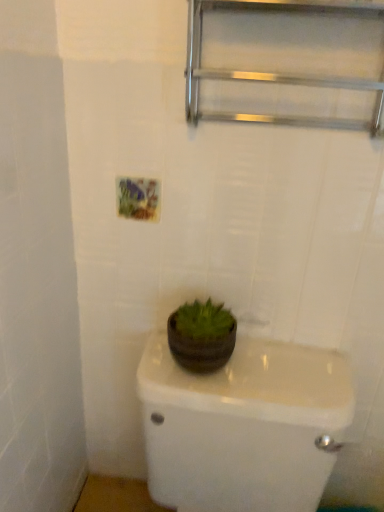
Question: Would you say dark brown matte flowerpot at center is inside or outside metallic silver shelf at upper center?

Choices:
 (A) inside
 (B) outside

Answer: (B)

Question: Considering the relative positions of dark brown matte flowerpot at center and metallic silver shelf at upper center in the image provided, is dark brown matte flowerpot at center to the left or to the right of metallic silver shelf at upper center?

Choices:
 (A) right
 (B) left

Answer: (B)

Question: Estimate the real-world distances between objects in this image. Which object is farther from the metallic silver shelf at upper center?

Choices:
 (A) dark brown matte flowerpot at center
 (B) matte brown pot at center

Answer: (B)

Question: Which is nearer to the metallic silver shelf at upper center?

Choices:
 (A) matte brown pot at center
 (B) dark brown matte flowerpot at center

Answer: (B)